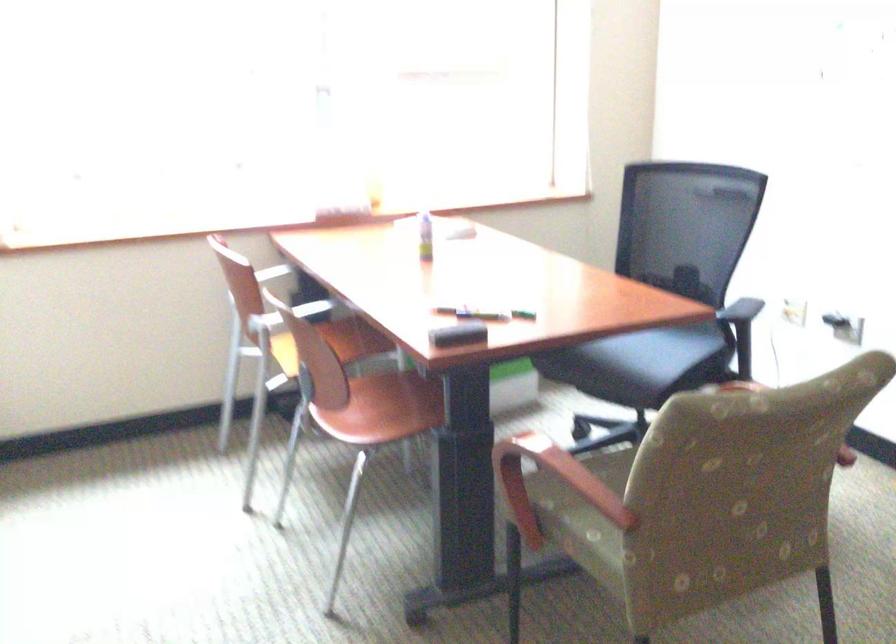
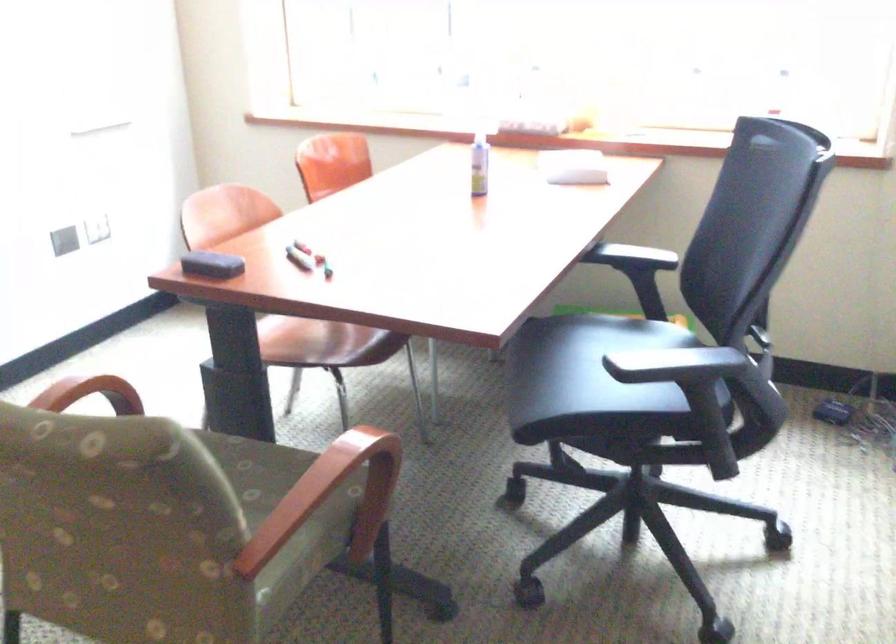
In the second image, find the point that corresponds to the point at 600,480 in the first image.

(251, 469)